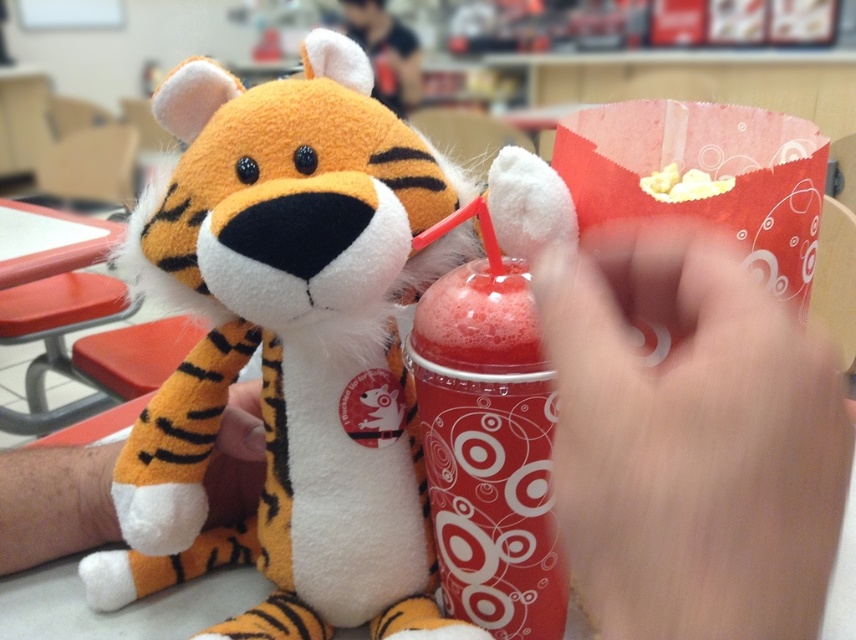
Question: Which of these objects is positioned closest to the dark blue shirt at upper center?

Choices:
 (A) translucent plastic cup at center
 (B) soft plush tiger at center

Answer: (B)

Question: Is dark blue shirt at upper center bigger than yellow popcorn at upper center?

Choices:
 (A) yes
 (B) no

Answer: (A)

Question: Can you confirm if soft plush tiger at center is bigger than dark blue shirt at upper center?

Choices:
 (A) no
 (B) yes

Answer: (A)

Question: Which object is positioned closest to the dark blue shirt at upper center?

Choices:
 (A) translucent plastic cup at center
 (B) yellow popcorn at upper center

Answer: (B)

Question: Does translucent plastic cup at center lie in front of dark blue shirt at upper center?

Choices:
 (A) yes
 (B) no

Answer: (A)

Question: Which object is positioned farthest from the soft plush tiger at center?

Choices:
 (A) translucent plastic cup at center
 (B) dark blue shirt at upper center
 (C) yellow popcorn at upper center

Answer: (B)